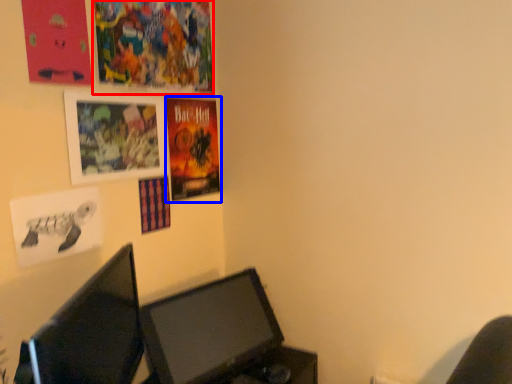
Question: Among these objects, which one is farthest to the camera, poster page (highlighted by a red box) or poster (highlighted by a blue box)?

Choices:
 (A) poster page
 (B) poster

Answer: (B)